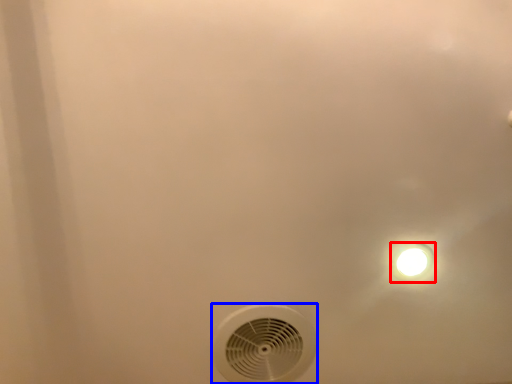
Question: Which object is further to the camera taking this photo, light fixture (highlighted by a red box) or mechanical fan (highlighted by a blue box)?

Choices:
 (A) light fixture
 (B) mechanical fan

Answer: (B)